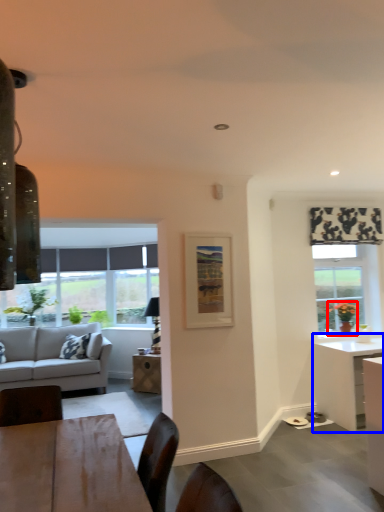
Question: Among these objects, which one is nearest to the camera, houseplant (highlighted by a red box) or desk (highlighted by a blue box)?

Choices:
 (A) houseplant
 (B) desk

Answer: (B)